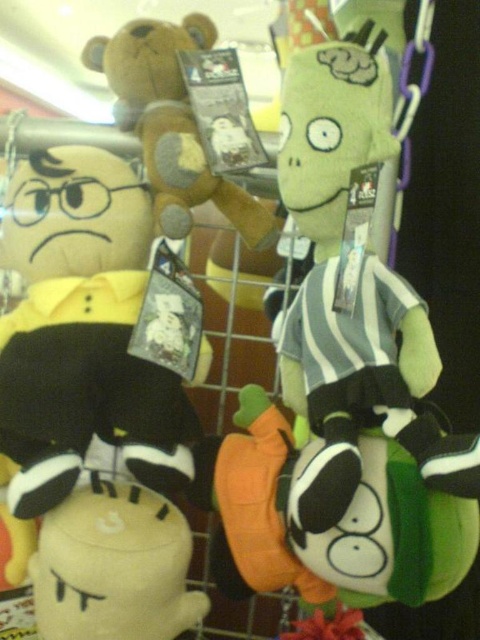
Question: Can you confirm if white plush toy at lower left is positioned to the right of brown plush bear at upper center?

Choices:
 (A) no
 (B) yes

Answer: (A)

Question: Is black plush toy at left smaller than brown plush bear at upper center?

Choices:
 (A) yes
 (B) no

Answer: (B)

Question: Considering the real-world distances, which object is closest to the white plush toy at lower left?

Choices:
 (A) black plush toy at left
 (B) brown plush bear at upper center

Answer: (A)

Question: Which object is the closest to the black plush toy at left?

Choices:
 (A) brown plush bear at upper center
 (B) white plush toy at lower left

Answer: (A)

Question: Which is nearer to the white plush toy at lower left?

Choices:
 (A) black plush toy at left
 (B) brown plush bear at upper center

Answer: (A)

Question: Where is black plush toy at left located in relation to brown plush bear at upper center in the image?

Choices:
 (A) right
 (B) left

Answer: (B)